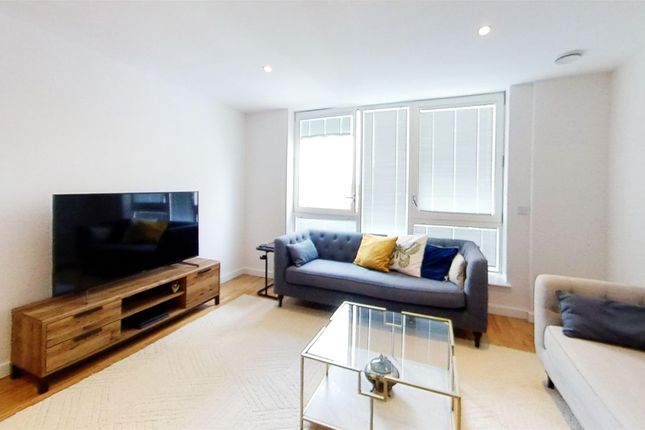
I want to click on floor, so pos(508,339).